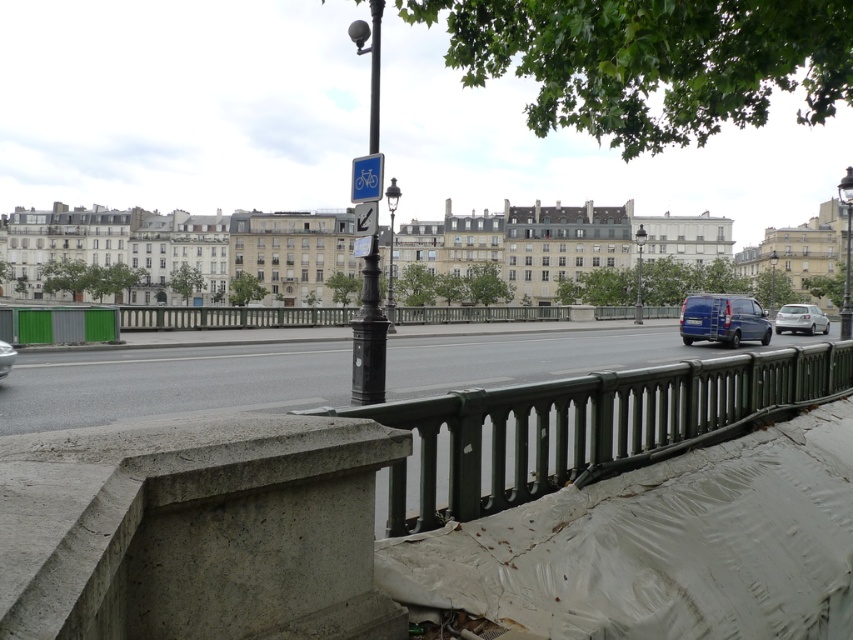
Does black metal pole at center have a smaller size compared to blue plastic sign at upper center?

Incorrect, black metal pole at center is not smaller in size than blue plastic sign at upper center.

Does black metal pole at center appear on the left side of blue plastic sign at upper center?

Correct, you'll find black metal pole at center to the left of blue plastic sign at upper center.

Locate an element on the screen. black metal pole at center is located at coordinates (369, 337).

Does green metal railing at center appear under silver metallic hatchback at right?

Yes, green metal railing at center is below silver metallic hatchback at right.

Who is lower down, green metal railing at center or silver metallic hatchback at right?

green metal railing at center

Which is behind, point (457, 497) or point (780, 330)?

Positioned behind is point (780, 330).

The image size is (853, 640). Identify the location of green metal railing at center. (592, 424).

Consider the image. Is black metal pole at center smaller than metallic silver car at lower left?

Incorrect, black metal pole at center is not smaller in size than metallic silver car at lower left.

Does black metal pole at center appear under metallic silver car at lower left?

Actually, black metal pole at center is above metallic silver car at lower left.

Does point (370, 372) come farther from viewer compared to point (0, 340)?

That is False.

Where is `black metal pole at center`? black metal pole at center is located at coordinates (369, 337).